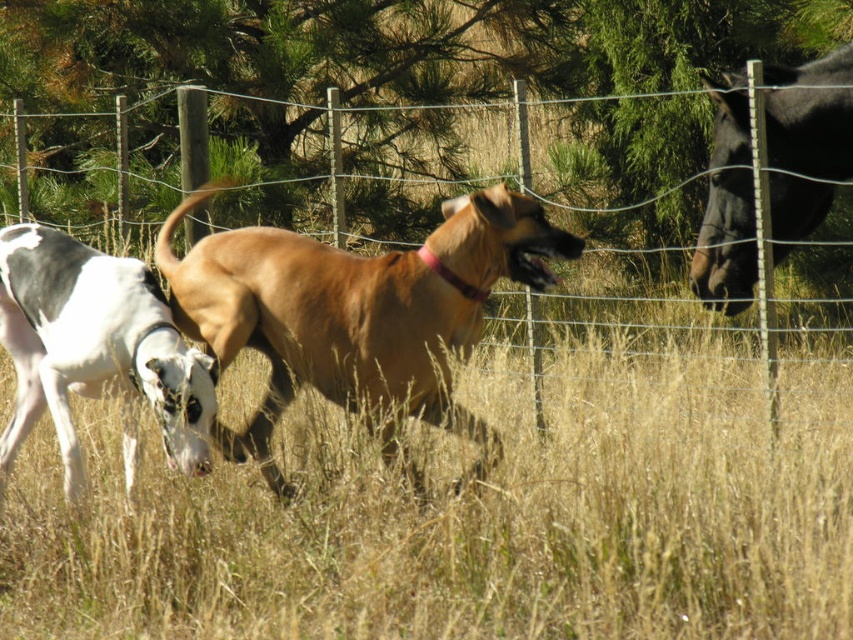
You are standing in the field and want to determine which of the two points, point (311, 298) or point (769, 266), is closer to you. Based on the image, which point is nearer?

Point (311, 298) is closer to the camera than point (769, 266), so it is the nearer point.